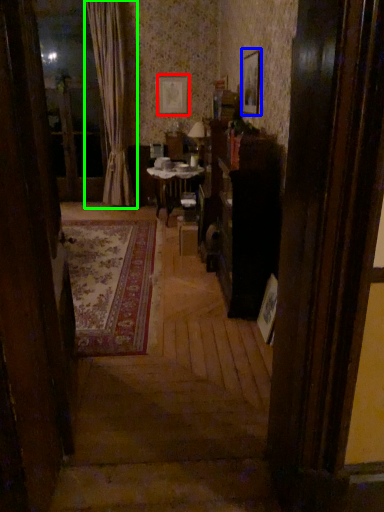
Question: Estimate the real-world distances between objects in this image. Which object is farther from picture frame (highlighted by a red box), picture frame (highlighted by a blue box) or curtain (highlighted by a green box)?

Choices:
 (A) picture frame
 (B) curtain

Answer: (A)